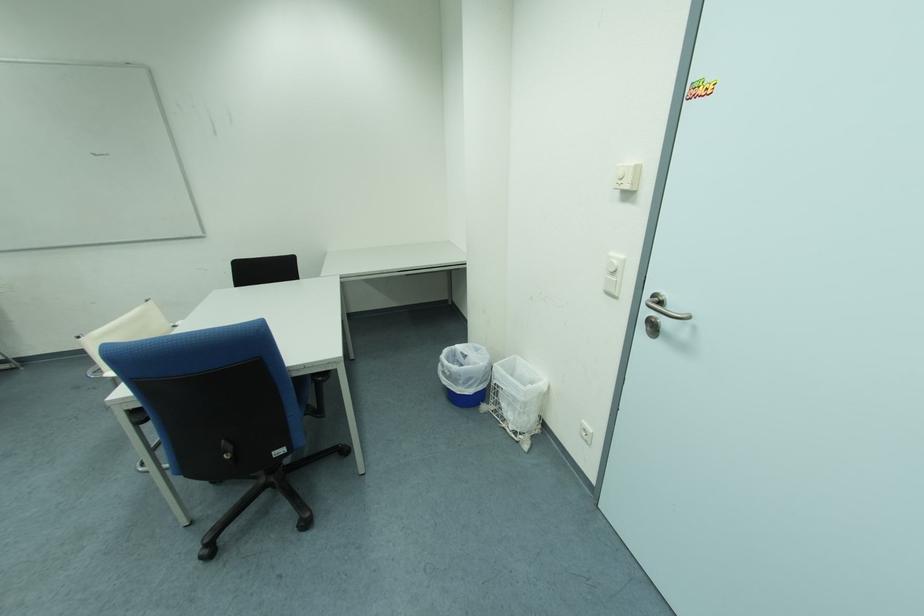
You are a GUI agent. You are given a task and a screenshot of the screen. Output one action in this format:
    pyautogui.click(x=<x>, y=<y>)
    Task: Click on the chair adjustment knob
    The width and height of the screenshot is (924, 616).
    Given the screenshot: What is the action you would take?
    pyautogui.click(x=227, y=450)